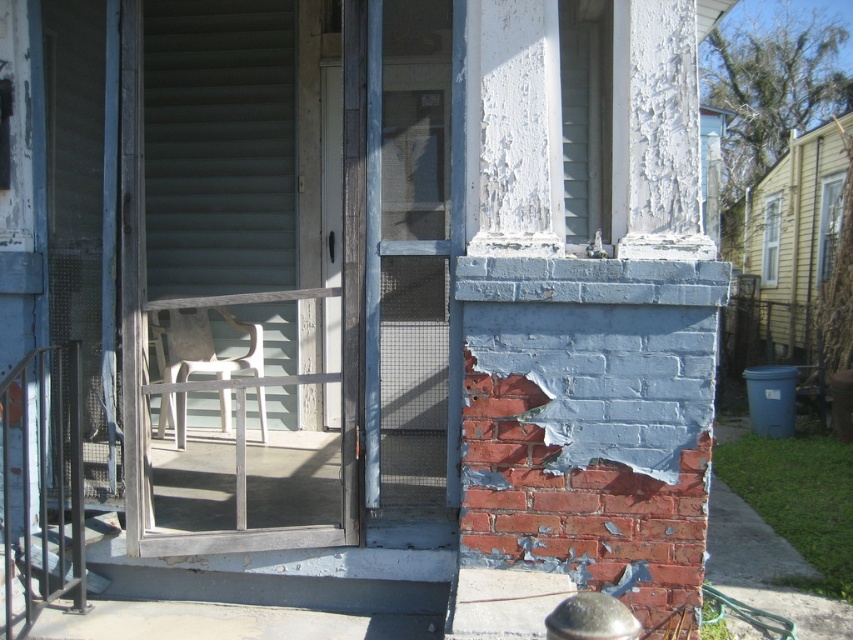
You are trying to move the white plastic chair at center through the gray wood screen door at center. Will the chair fit through the door?

The gray wood screen door at center might be wider than white plastic chair at center, so there is a possibility that the chair can fit through the door if its dimensions are within the door width.

You are standing on the porch and want to open the gray wood screen door at center. If the door is at point 0.420, 0.286, where would you reach to open it?

The gray wood screen door at center is located at point [242,268], so you should reach towards that coordinate to open it.

You are standing on the porch and want to place two markers at specific coordinates. You have to place a marker at point (x=277, y=321) and another at (x=186, y=328). Which marker will be closer to the screen door?

Point (x=277, y=321) is behind point (x=186, y=328), so the marker at point (x=186, y=328) will be closer to the screen door.